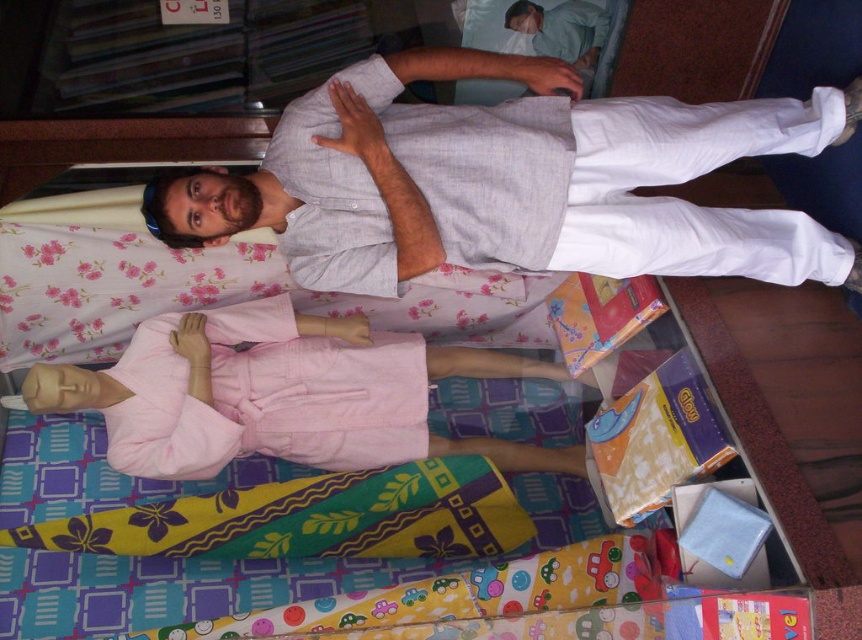
You are standing in a store and want to reach a specific point marked at coordinates point (485, 449). If you are currently 2 meters away from the entrance, can you comfortably walk to that point without needing to move any obstacles?

The distance of point (485, 449) from camera is 1.92 meters, so yes, you can comfortably walk to that point as the distance is slightly less than your current position from the entrance.

You are a customer standing in the store and want to pick up the pink cotton robe at lower left. Can you reach it without moving closer than your current position?

The pink cotton robe at lower left is 1.66 meters away from the viewer, so you can reach it without moving closer than your current position.